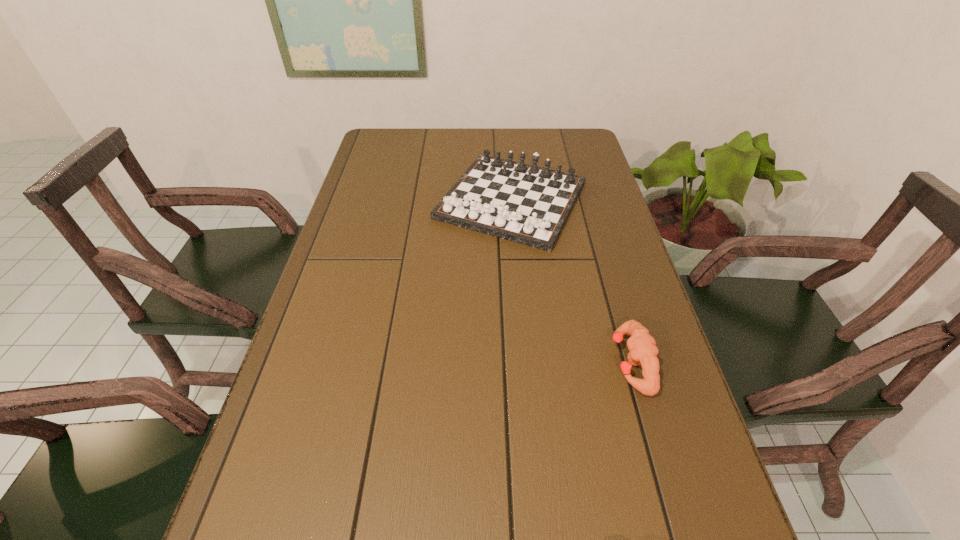
In order to click on puncher present at the right edge in this screenshot , I will do (643, 352).

Locate an element on the screen. Image resolution: width=960 pixels, height=540 pixels. object that is at the far right corner is located at coordinates (526, 204).

In the image, there is a desktop. Where is `vacant region at the far edge`? vacant region at the far edge is located at coordinates (444, 140).

This screenshot has width=960, height=540. Find the location of `vacant region at the left edge of the desktop`. vacant region at the left edge of the desktop is located at coordinates (304, 356).

What are the coordinates of `free space at the right edge of the desktop` in the screenshot? It's located at (598, 247).

Identify the location of vacant area at the far left corner of the desktop. Image resolution: width=960 pixels, height=540 pixels. (372, 141).

Find the location of a particular element. This screenshot has width=960, height=540. vacant space at the far right corner is located at coordinates [x=552, y=139].

I want to click on free space between the puncher and the farther object, so click(571, 281).

Where is `free point between the farther object and the puncher`? This screenshot has height=540, width=960. free point between the farther object and the puncher is located at coordinates (571, 281).